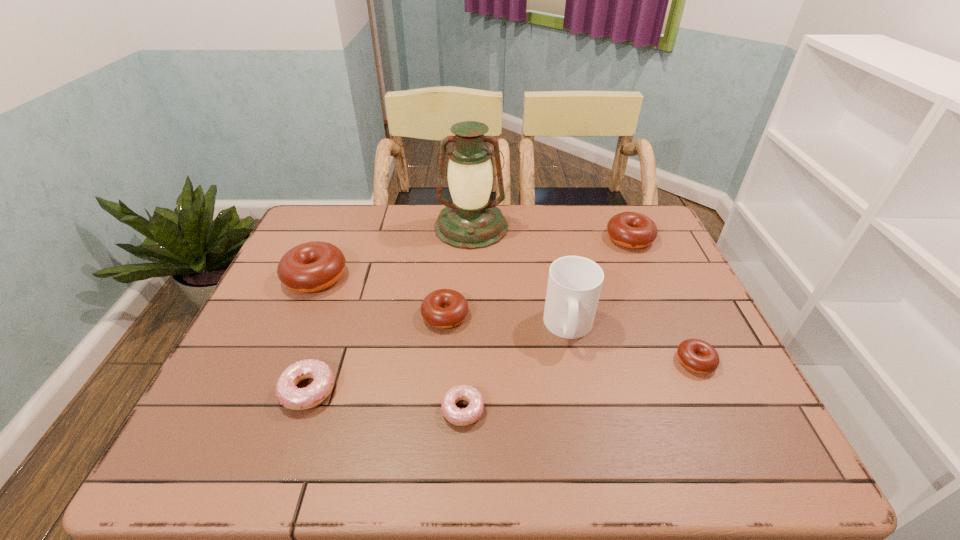
At what (x,y) coordinates should I click in order to perform the action: click on the nearest chocolate doughnut. Please return your answer as a coordinate pair (x, y). The width and height of the screenshot is (960, 540). Looking at the image, I should click on (696, 355).

Image resolution: width=960 pixels, height=540 pixels. What are the coordinates of `the right pink doughnut` in the screenshot? It's located at (469, 415).

What are the coordinates of `vacant space located with the light compartment facing forward on the tallest object` in the screenshot? It's located at (468, 341).

Where is `free region located on the handle side of the sixth object from left to right`? free region located on the handle side of the sixth object from left to right is located at coordinates (580, 377).

Find the location of a particular element. free space located 0.350m on the front of the fifth nearest doughnut is located at coordinates (255, 417).

Image resolution: width=960 pixels, height=540 pixels. I want to click on free space located on the front of the fifth shortest object, so click(651, 287).

You are a GUI agent. You are given a task and a screenshot of the screen. Output one action in this format:
    pyautogui.click(x=<x>, y=<y>)
    Task: Click on the vacant area situated 0.200m on the front of the third farthest doughnut
    The height and width of the screenshot is (540, 960).
    Given the screenshot: What is the action you would take?
    pyautogui.click(x=438, y=404)

Find the location of a particular element. This screenshot has height=540, width=960. vacant position located on the back of the left pink doughnut is located at coordinates (352, 262).

Where is `free spot located on the front of the smallest chocolate doughnut`? The image size is (960, 540). free spot located on the front of the smallest chocolate doughnut is located at coordinates (741, 460).

Locate an element on the screen. free space located 0.070m on the back of the smaller pink doughnut is located at coordinates (465, 366).